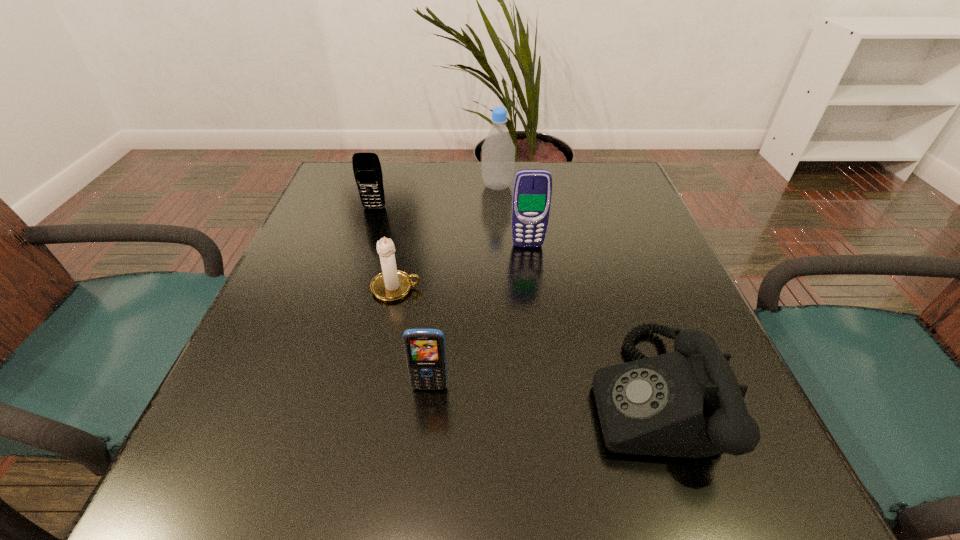
Locate an element on the screen. free space located on the front of the bottle is located at coordinates (503, 286).

The height and width of the screenshot is (540, 960). I want to click on vacant area situated on the front-facing side of the rightmost cellular telephone, so click(x=530, y=262).

Where is `blank space located 0.070m on the screen of the farthest cellular telephone`? blank space located 0.070m on the screen of the farthest cellular telephone is located at coordinates click(x=368, y=228).

At what (x,y) coordinates should I click in order to perform the action: click on blank area located on the screen of the nearest cellular telephone. Please return your answer as a coordinate pair (x, y). This screenshot has height=540, width=960. Looking at the image, I should click on (420, 491).

This screenshot has width=960, height=540. I want to click on vacant region located on the handle side of the second object from left to right, so click(467, 288).

Where is `vacant area located on the dial of the rightmost object`? This screenshot has width=960, height=540. vacant area located on the dial of the rightmost object is located at coordinates (348, 394).

Locate an element on the screen. The width and height of the screenshot is (960, 540). vacant point located 0.270m on the dial of the rightmost object is located at coordinates (418, 394).

I want to click on free space located 0.150m on the dial of the rightmost object, so click(495, 394).

Identify the location of bottle at the far edge. pos(498,150).

Locate an element on the screen. This screenshot has width=960, height=540. cellular telephone positioned at the far edge is located at coordinates (367, 170).